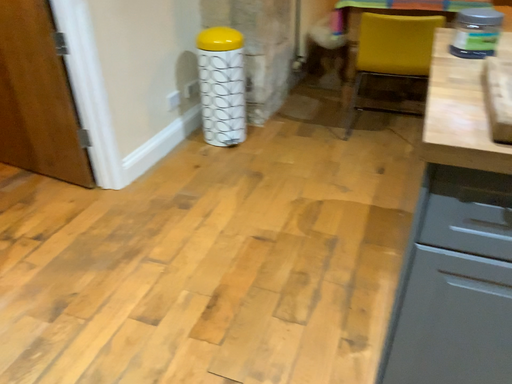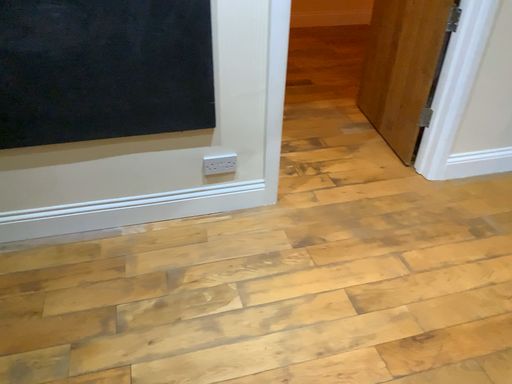
Question: Which way did the camera rotate in the video?

Choices:
 (A) rotated left
 (B) rotated right

Answer: (A)